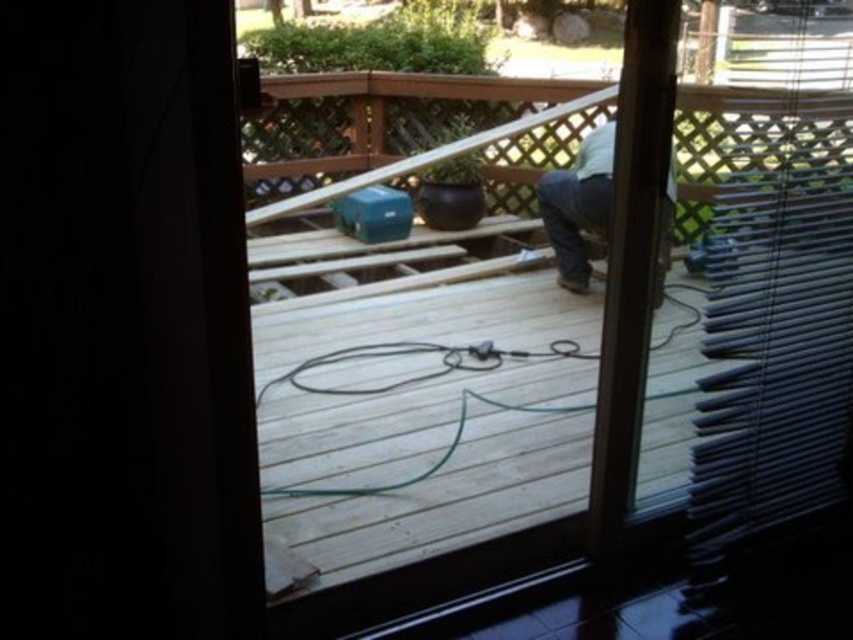
You are a delivery person holding a package and standing outside the transparent glass door at center. You need to place the package on the light brown wood pants at center. Can you directly place the package there without entering the house?

The transparent glass door at center is in front of the light brown wood pants at center, so you cannot directly place the package there without entering the house since the door is blocking the path.